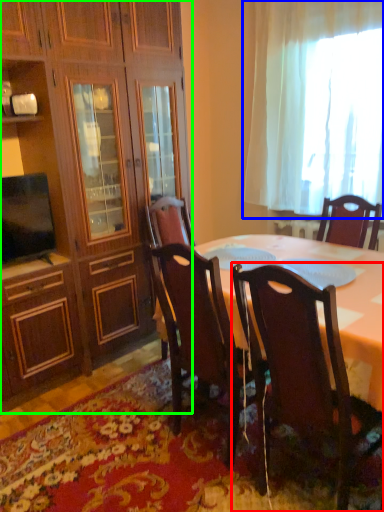
Question: Which object is positioned closest to chair (highlighted by a red box)? Select from curtain (highlighted by a blue box) and cabinetry (highlighted by a green box).

Choices:
 (A) curtain
 (B) cabinetry

Answer: (B)